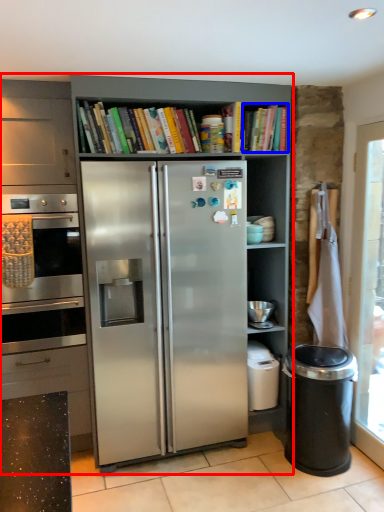
Question: Among these objects, which one is farthest to the camera, cupboard (highlighted by a red box) or book (highlighted by a blue box)?

Choices:
 (A) cupboard
 (B) book

Answer: (B)